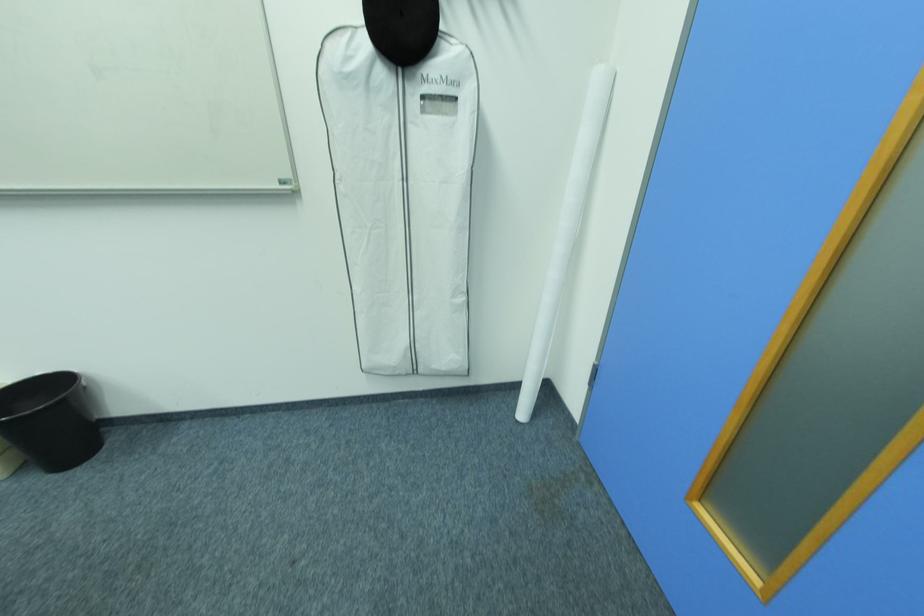
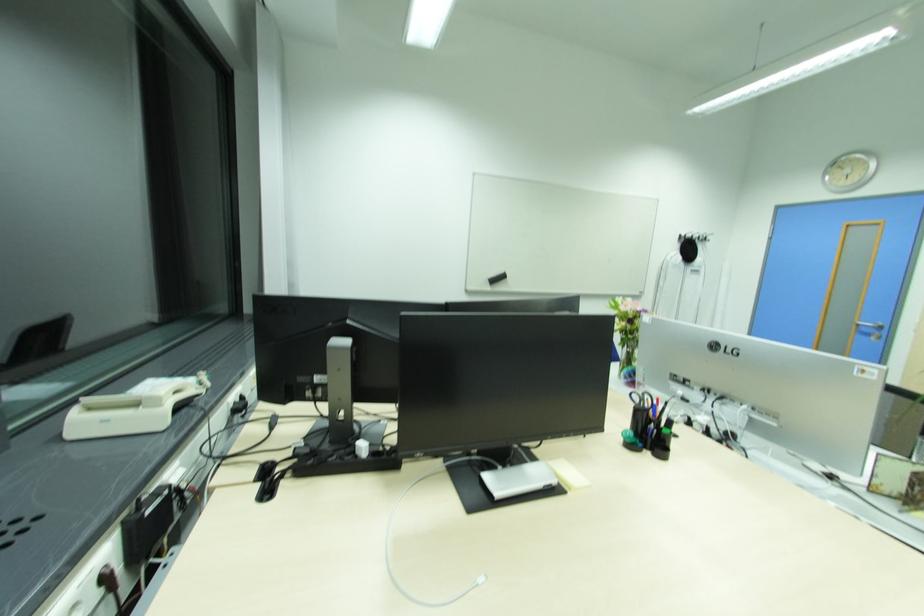
What movement of the cameraman would produce the second image?

The cameraman walked toward left, backward.